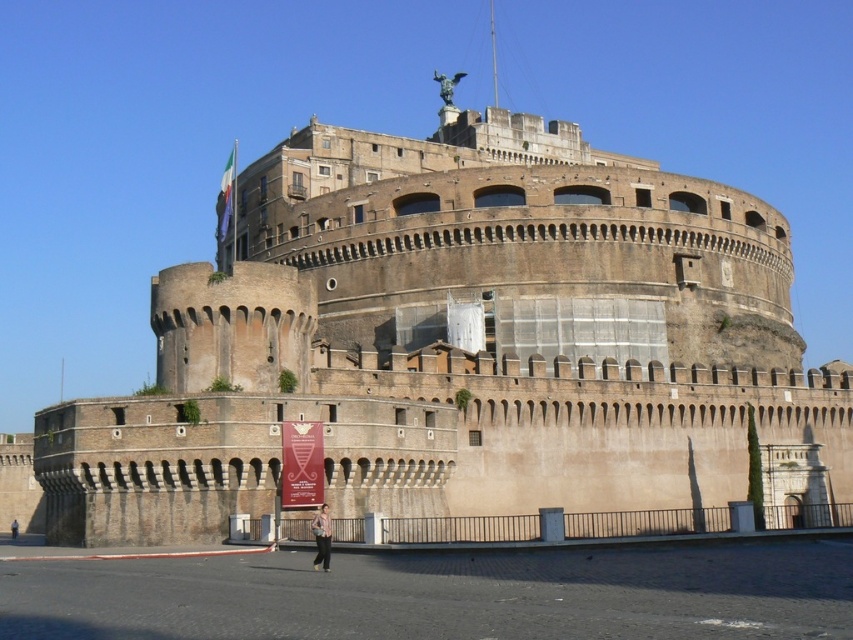
Question: Is brown stone castle at center in front of striped cotton shirt at lower center?

Choices:
 (A) no
 (B) yes

Answer: (A)

Question: Is brown stone castle at center positioned before striped cotton shirt at lower center?

Choices:
 (A) yes
 (B) no

Answer: (B)

Question: Does brown stone castle at center appear on the left side of striped cotton shirt at lower center?

Choices:
 (A) yes
 (B) no

Answer: (B)

Question: Which point is closer to the camera?

Choices:
 (A) (462, 260)
 (B) (317, 538)

Answer: (B)

Question: Which point appears farthest from the camera in this image?

Choices:
 (A) (763, 292)
 (B) (318, 556)

Answer: (A)